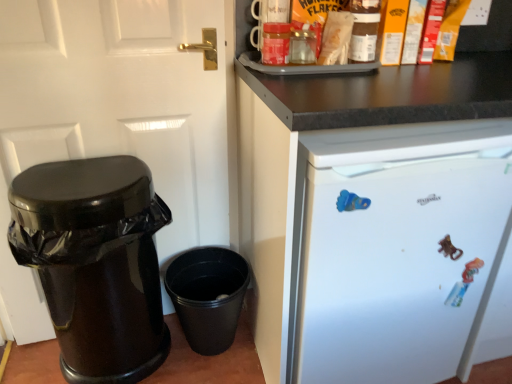
Question: Is white matte refrigerator at upper right completely or partially outside of white glossy door at left?

Choices:
 (A) yes
 (B) no

Answer: (A)

Question: Can you confirm if white matte refrigerator at upper right is positioned to the left of white glossy door at left?

Choices:
 (A) yes
 (B) no

Answer: (B)

Question: Is white matte refrigerator at upper right shorter than white glossy door at left?

Choices:
 (A) yes
 (B) no

Answer: (A)

Question: Is white matte refrigerator at upper right aimed at white glossy door at left?

Choices:
 (A) yes
 (B) no

Answer: (B)

Question: Can you confirm if white matte refrigerator at upper right is bigger than white glossy door at left?

Choices:
 (A) yes
 (B) no

Answer: (A)

Question: In terms of width, does glossy plastic trash can at left look wider or thinner when compared to matte brown jar at upper center?

Choices:
 (A) thin
 (B) wide

Answer: (B)

Question: Looking at the image, does glossy plastic trash can at left seem bigger or smaller compared to matte brown jar at upper center?

Choices:
 (A) big
 (B) small

Answer: (A)

Question: In terms of height, does glossy plastic trash can at left look taller or shorter compared to matte brown jar at upper center?

Choices:
 (A) short
 (B) tall

Answer: (B)

Question: Relative to matte brown jar at upper center, is glossy plastic trash can at left in front or behind?

Choices:
 (A) behind
 (B) front

Answer: (B)

Question: From a real-world perspective, is white glossy door at left positioned above or below black plastic bucket at lower center?

Choices:
 (A) below
 (B) above

Answer: (B)

Question: In terms of size, does white glossy door at left appear bigger or smaller than black plastic bucket at lower center?

Choices:
 (A) big
 (B) small

Answer: (A)

Question: In the image, is white glossy door at left positioned in front of or behind black plastic bucket at lower center?

Choices:
 (A) front
 (B) behind

Answer: (A)

Question: From the image's perspective, is white glossy door at left positioned above or below black plastic bucket at lower center?

Choices:
 (A) below
 (B) above

Answer: (B)

Question: From the image's perspective, relative to white glossy door at left, is matte brown jar at upper center above or below?

Choices:
 (A) below
 (B) above

Answer: (B)

Question: Is matte brown jar at upper center bigger or smaller than white glossy door at left?

Choices:
 (A) small
 (B) big

Answer: (A)